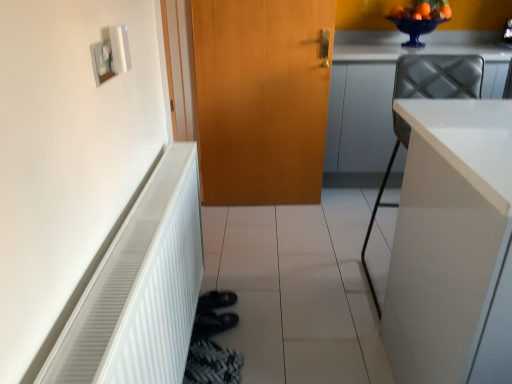
The width and height of the screenshot is (512, 384). I want to click on vacant area that is in front of wooden door at center, so click(x=268, y=231).